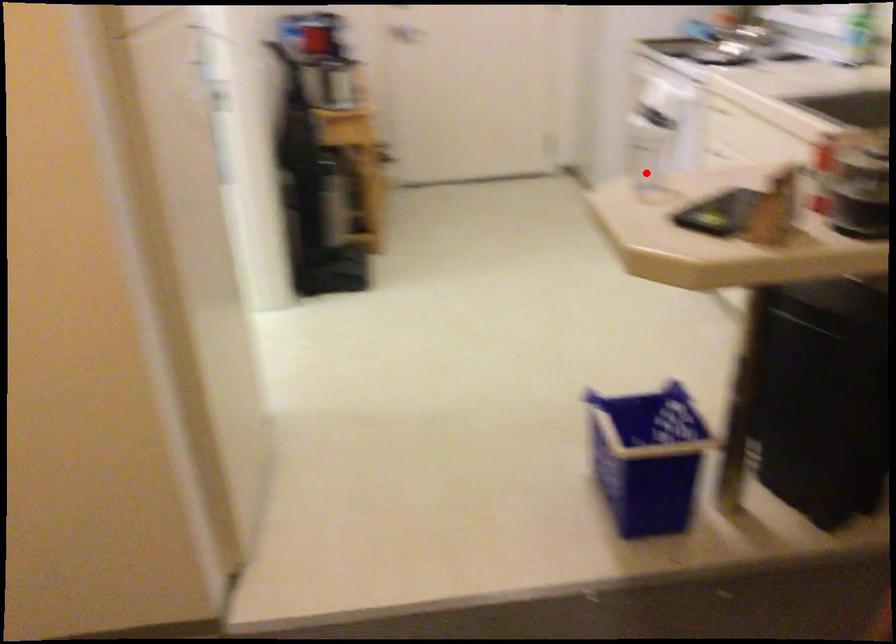
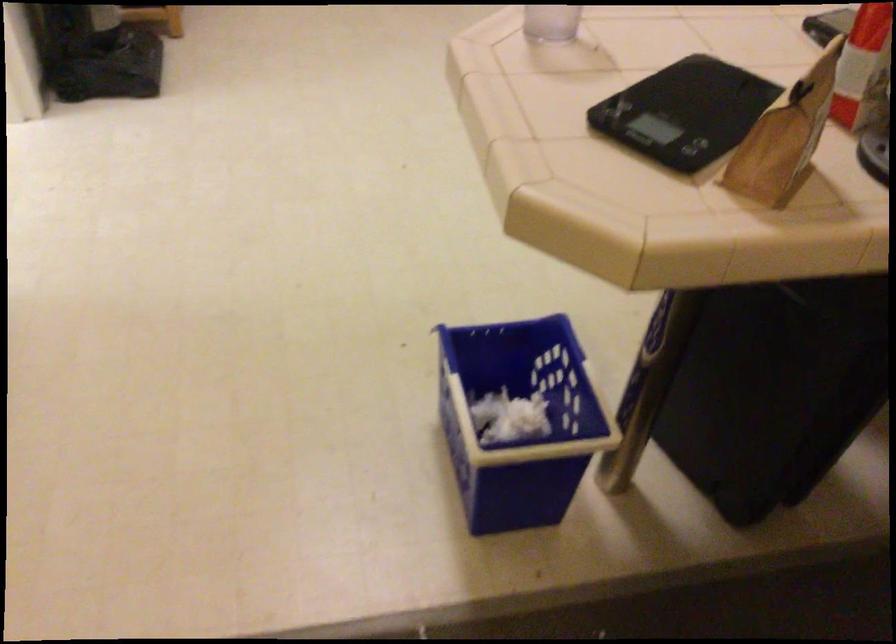
Find the pixel in the second image that matches the highlighted location in the first image.

(550, 23)